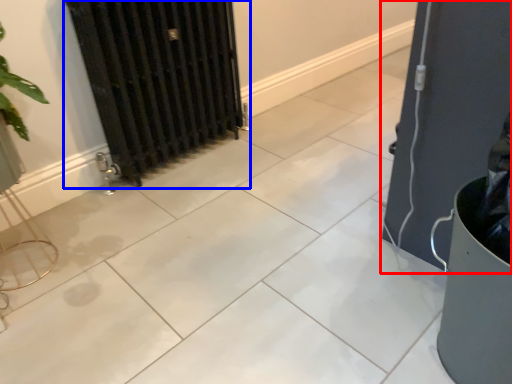
Question: Which point is further to the camera, door (highlighted by a red box) or radiator (highlighted by a blue box)?

Choices:
 (A) door
 (B) radiator

Answer: (B)